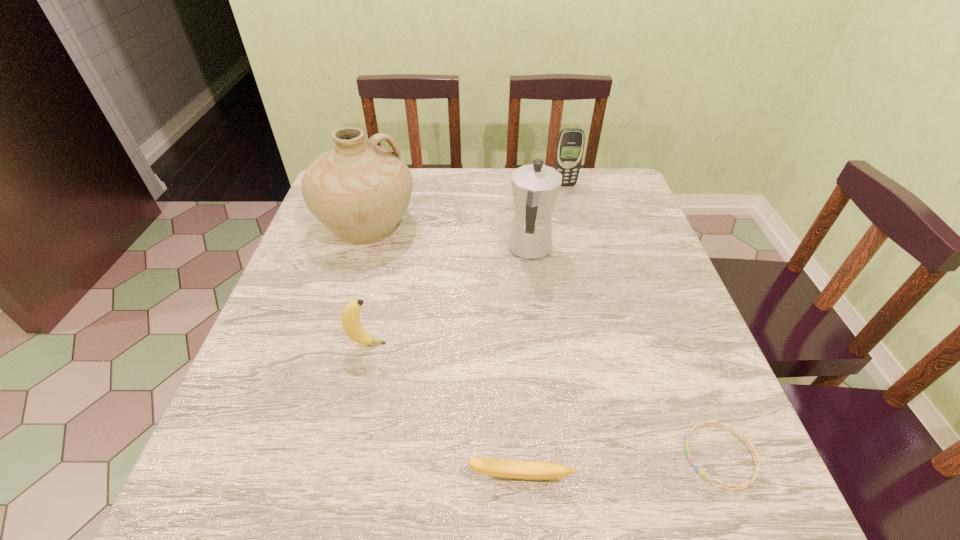
Find the location of a particular element. This screenshot has width=960, height=540. bracelet present at the near edge is located at coordinates (757, 467).

Find the location of a particular element. object located in the left edge section of the desktop is located at coordinates (359, 191).

Where is `cellular telephone that is at the right edge`? The width and height of the screenshot is (960, 540). cellular telephone that is at the right edge is located at coordinates (570, 145).

Identify the location of bracelet situated at the right edge. The height and width of the screenshot is (540, 960). (757, 467).

The width and height of the screenshot is (960, 540). Find the location of `object that is at the far left corner`. object that is at the far left corner is located at coordinates (359, 191).

Where is `object present at the far right corner`? The height and width of the screenshot is (540, 960). object present at the far right corner is located at coordinates (570, 145).

This screenshot has width=960, height=540. I want to click on object that is at the near right corner, so click(757, 467).

I want to click on free space at the far edge of the desktop, so (431, 212).

In the image, there is a desktop. Where is `blank space at the near edge`? This screenshot has height=540, width=960. blank space at the near edge is located at coordinates (599, 503).

Locate an element on the screen. vacant space at the left edge of the desktop is located at coordinates (271, 348).